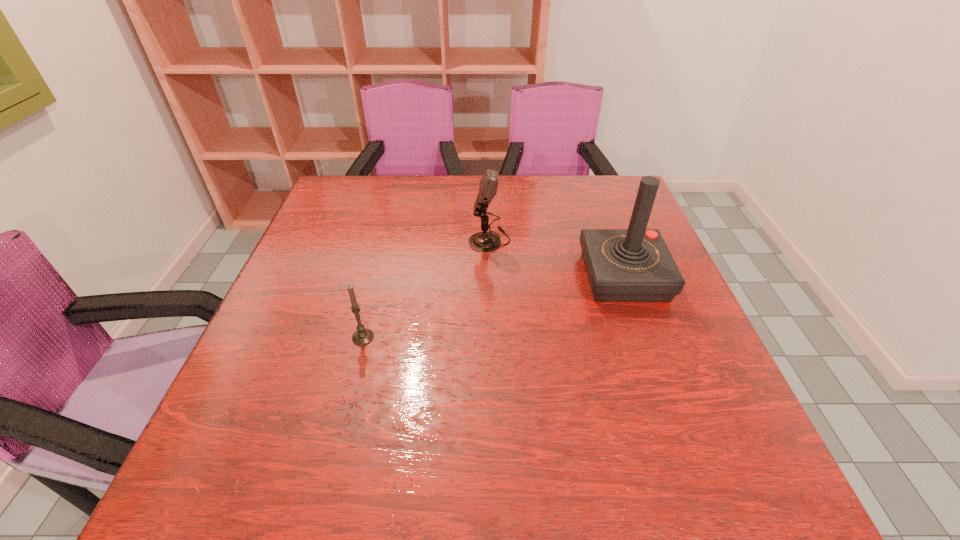
In order to click on the closest object to the leftmost object in this screenshot , I will do `click(484, 241)`.

The height and width of the screenshot is (540, 960). In order to click on object identified as the closest to the second object from right to left in this screenshot , I will do 623,265.

The image size is (960, 540). In order to click on free point that satisfies the following two spatial constraints: 1. on the rectangular base of the rightmost object; 2. on the front side of the shortest object in this screenshot , I will do `click(645, 338)`.

The height and width of the screenshot is (540, 960). Find the location of `blank area in the image that satisfies the following two spatial constraints: 1. on the rectangular base of the rightmost object; 2. on the front side of the shortest object`. blank area in the image that satisfies the following two spatial constraints: 1. on the rectangular base of the rightmost object; 2. on the front side of the shortest object is located at coordinates (645, 338).